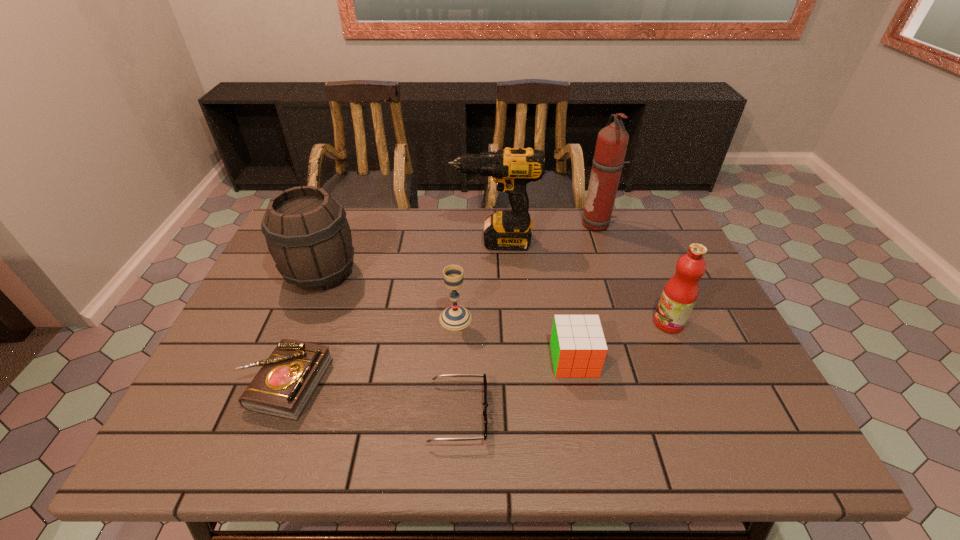
Where is `free space located 0.250m on the side of the second object from right to left with the label and nozzle`? free space located 0.250m on the side of the second object from right to left with the label and nozzle is located at coordinates (506, 225).

Where is `free space located 0.070m on the side of the second object from right to left with the label and nozzle`? The height and width of the screenshot is (540, 960). free space located 0.070m on the side of the second object from right to left with the label and nozzle is located at coordinates (561, 225).

Where is `free location located 0.150m at the tip of the seventh shortest object`? The height and width of the screenshot is (540, 960). free location located 0.150m at the tip of the seventh shortest object is located at coordinates (404, 241).

This screenshot has height=540, width=960. I want to click on vacant area situated at the tip of the seventh shortest object, so click(347, 241).

Locate an element on the screen. The image size is (960, 540). vacant position located at the tip of the seventh shortest object is located at coordinates (347, 241).

Identify the location of vacant area situated on the right of the wine bucket. This screenshot has width=960, height=540. (480, 274).

Locate an element on the screen. The width and height of the screenshot is (960, 540). vacant space located 0.400m on the front label of the fruit juice is located at coordinates (497, 323).

In order to click on free space located 0.120m on the front label of the fruit juice in this screenshot , I will do `click(607, 323)`.

Where is `vacant space located on the front label of the fruit juice`? vacant space located on the front label of the fruit juice is located at coordinates (513, 323).

Locate an element on the screen. The width and height of the screenshot is (960, 540). vacant space situated on the front of the fifth tallest object is located at coordinates (449, 425).